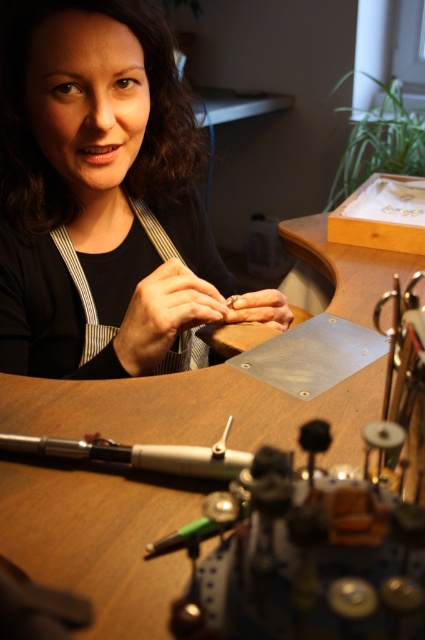
Can you confirm if matte silver tool at center is thinner than matte gold ring at center?

No.

Who is higher up, matte silver tool at center or matte gold ring at center?

matte gold ring at center is higher up.

Locate an element on the screen. This screenshot has width=425, height=640. matte silver tool at center is located at coordinates (164, 314).

Does matte black apron at center come in front of matte gold ring at center?

Yes, it is in front of matte gold ring at center.

Who is more forward, (107, 76) or (260, 294)?

Point (107, 76)

The width and height of the screenshot is (425, 640). I want to click on matte black apron at center, so 99,195.

Between wooden table at center and matte silver tool at center, which one has more height?

wooden table at center is taller.

Can you confirm if wooden table at center is smaller than matte silver tool at center?

Actually, wooden table at center might be larger than matte silver tool at center.

Is point (289, 240) less distant than point (161, 298)?

No, (289, 240) is behind (161, 298).

Find the location of `wooden table at center`. wooden table at center is located at coordinates (343, 262).